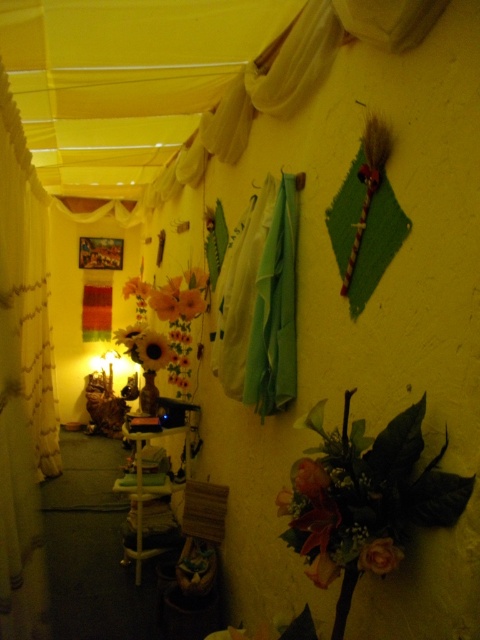
You are a delivery person holding a package that is 3 meters long. You are in the hallway and want to place the package on the floor without moving any objects. Is there enough space in front of the matte brown vase at center to fit the package?

The matte brown vase at center is 2.93 meters away from camera. Since the package is 3 meters long, it would not fit in the available space as the distance is slightly shorter than the package length.